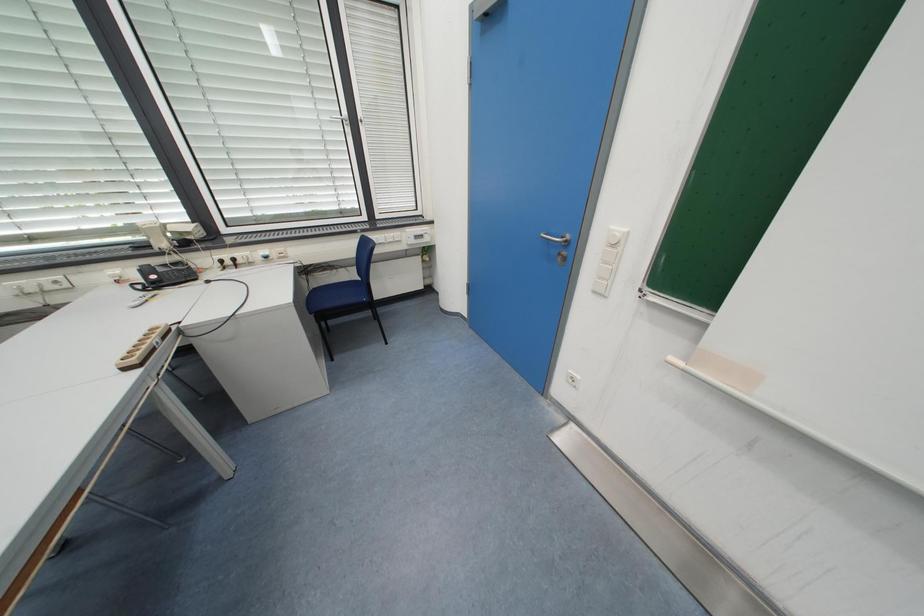
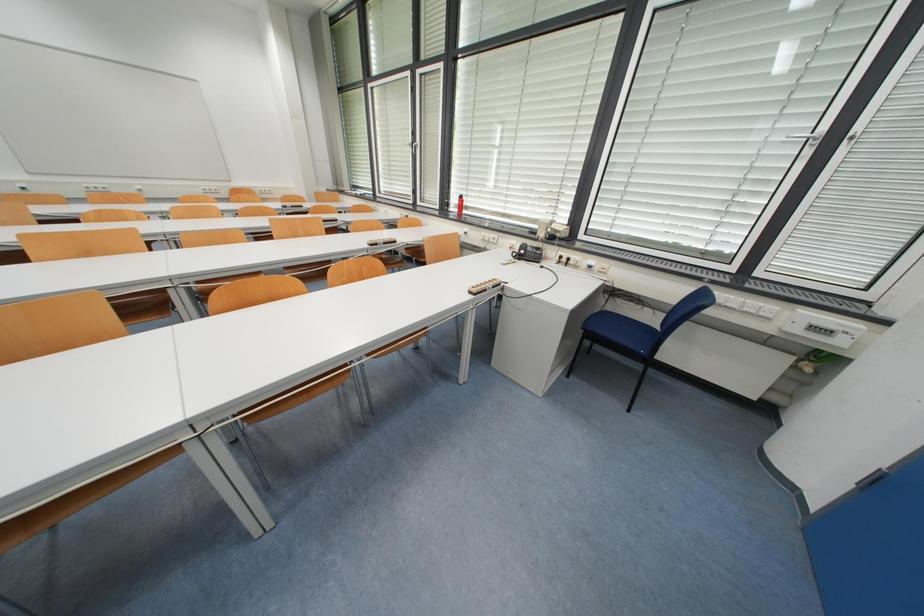
How did the camera likely rotate?

The rotation direction of the camera is left-down.